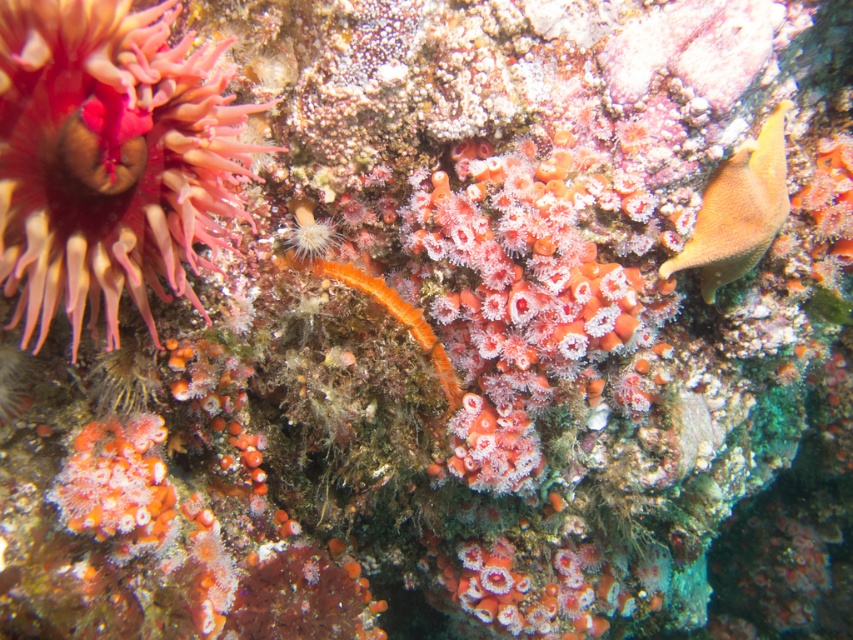
You are a marine biologist studying underwater coordinates. You need to locate the matte pink coral at upper left. What are its coordinates?

The coordinates for the matte pink coral at upper left are point (x=109, y=157).

You are a marine biologist examining an underwater scene. You notice two points marked in the image. The first point is at coordinates point (103, 244) and the second is at point (703, 266). Based on the scene description, which point is closer to the observer?

Point (103, 244) is in front of point (703, 266), so it is closer to the observer.